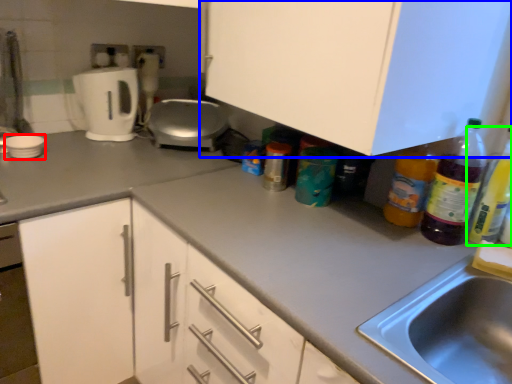
Question: Considering the real-world distances, which object is farthest from appliance (highlighted by a red box)? cabinetry (highlighted by a blue box) or bottle (highlighted by a green box)?

Choices:
 (A) cabinetry
 (B) bottle

Answer: (B)